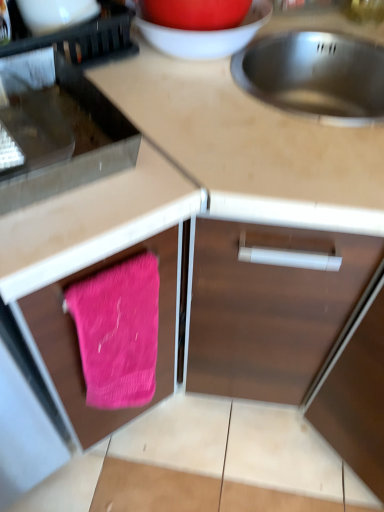
Question: Is pink knitted towel at lower left not inside metallic stainless steel sink at upper right?

Choices:
 (A) yes
 (B) no

Answer: (A)

Question: From the image's perspective, would you say pink knitted towel at lower left is positioned over metallic stainless steel sink at upper right?

Choices:
 (A) yes
 (B) no

Answer: (B)

Question: Can you confirm if pink knitted towel at lower left is positioned to the right of metallic stainless steel sink at upper right?

Choices:
 (A) yes
 (B) no

Answer: (B)

Question: From a real-world perspective, is pink knitted towel at lower left below metallic stainless steel sink at upper right?

Choices:
 (A) yes
 (B) no

Answer: (A)

Question: Considering the relative sizes of pink knitted towel at lower left and metallic stainless steel sink at upper right in the image provided, is pink knitted towel at lower left taller than metallic stainless steel sink at upper right?

Choices:
 (A) no
 (B) yes

Answer: (B)

Question: Is black plastic dish rack at upper left, which ranks as the 3th appliance in bottom-to-top order, taller or shorter than metallic stainless steel oven at left, arranged as the 2th appliance when viewed from the left?

Choices:
 (A) short
 (B) tall

Answer: (B)

Question: Which is correct: black plastic dish rack at upper left, which is counted as the 1th appliance, starting from the left, is inside metallic stainless steel oven at left, the second appliance positioned from the bottom, or outside of it?

Choices:
 (A) outside
 (B) inside

Answer: (A)

Question: Relative to metallic stainless steel oven at left, the second appliance in the right-to-left sequence, is black plastic dish rack at upper left, marked as the third appliance in a right-to-left arrangement, in front or behind?

Choices:
 (A) behind
 (B) front

Answer: (A)

Question: Visually, is black plastic dish rack at upper left, marked as the third appliance in a right-to-left arrangement, positioned to the left or to the right of metallic stainless steel oven at left, the second appliance in the right-to-left sequence?

Choices:
 (A) left
 (B) right

Answer: (A)

Question: Is pink fabric at lower left in front of or behind black plastic dish rack at upper left, arranged as the first appliance when viewed from the top, in the image?

Choices:
 (A) behind
 (B) front

Answer: (B)

Question: From their relative heights in the image, would you say pink fabric at lower left is taller or shorter than black plastic dish rack at upper left, which is counted as the 1th appliance, starting from the left?

Choices:
 (A) short
 (B) tall

Answer: (B)

Question: From a real-world perspective, is pink fabric at lower left physically located above or below black plastic dish rack at upper left, marked as the third appliance in a right-to-left arrangement?

Choices:
 (A) above
 (B) below

Answer: (B)

Question: Choose the correct answer: Is pink fabric at lower left inside black plastic dish rack at upper left, which is counted as the 1th appliance, starting from the left, or outside it?

Choices:
 (A) inside
 (B) outside

Answer: (B)

Question: From the image's perspective, is metallic stainless steel sink at upper right above or below matte white bowl at upper center?

Choices:
 (A) above
 (B) below

Answer: (B)

Question: Considering the positions of point (326, 210) and point (152, 36), is point (326, 210) closer or farther from the camera than point (152, 36)?

Choices:
 (A) closer
 (B) farther

Answer: (A)